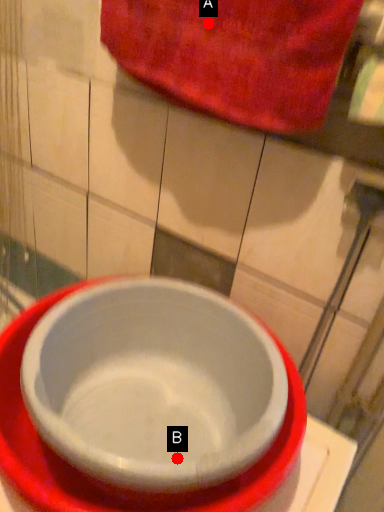
Question: Two points are circled on the image, labeled by A and B beside each circle. Which point is farther to the camera?

Choices:
 (A) A is further
 (B) B is further

Answer: (B)